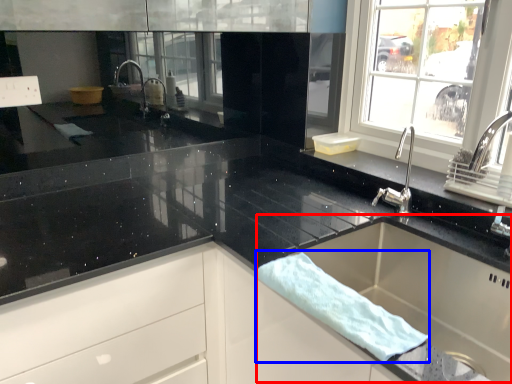
Question: Which of the following is the farthest to the observer, sink (highlighted by a red box) or bath towel (highlighted by a blue box)?

Choices:
 (A) sink
 (B) bath towel

Answer: (A)